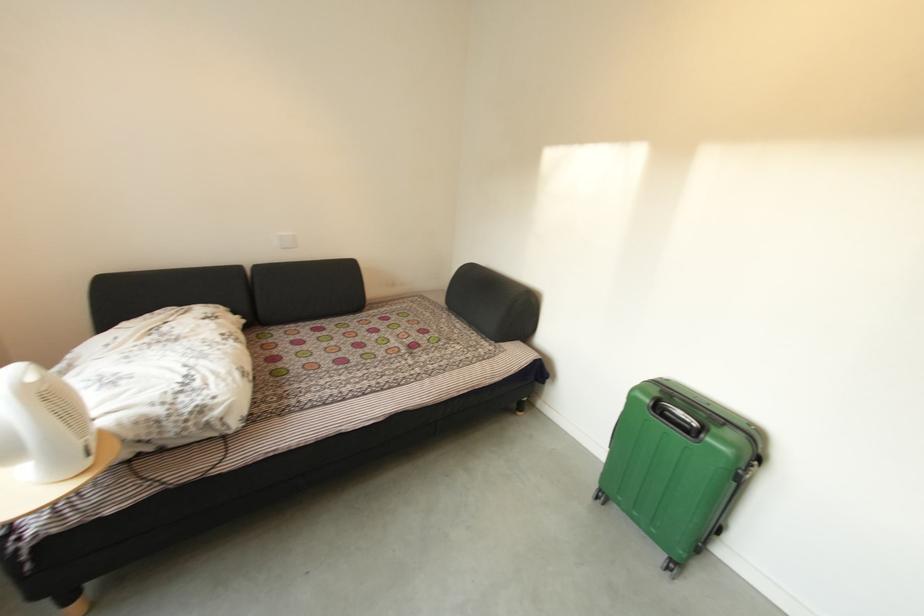
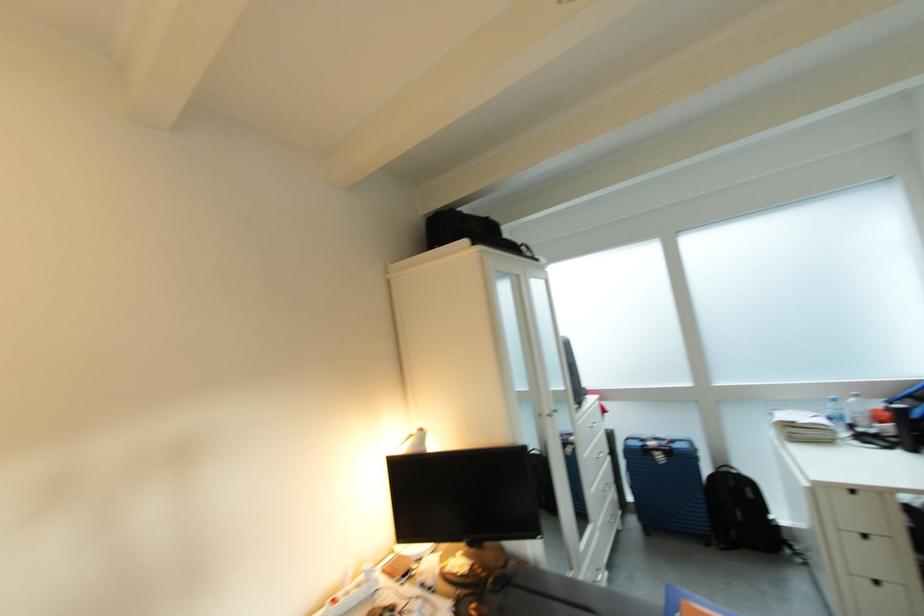
Question: The images are taken continuously from a first-person perspective. In which direction is your viewpoint rotating?

Choices:
 (A) Left
 (B) Right
 (C) Up
 (D) Down

Answer: (B)